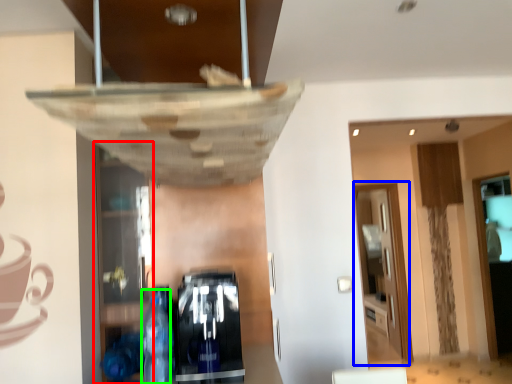
Question: Considering the real-world distances, which object is farthest from shelf (highlighted by a red box)? glass door (highlighted by a blue box) or bottle (highlighted by a green box)?

Choices:
 (A) glass door
 (B) bottle

Answer: (A)